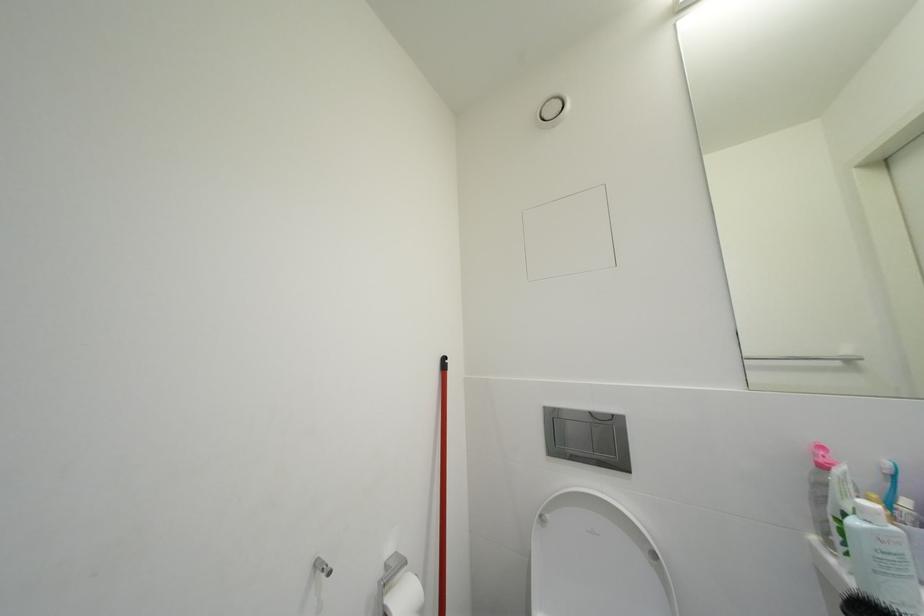
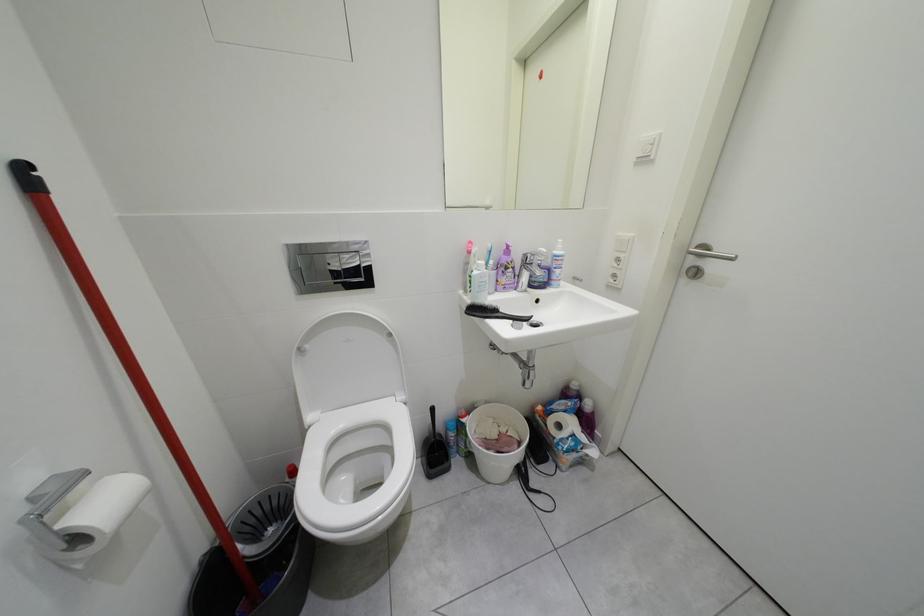
Based on the continuous images, in which direction is the camera rotating?

The camera's rotation is toward right-down.